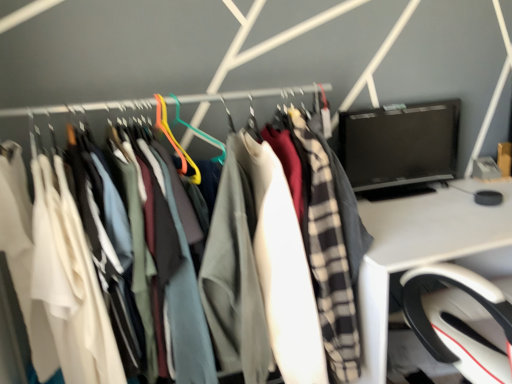
Question: Considering the relative sizes of matte fabric clothes at left and black glossy monitor at upper right in the image provided, is matte fabric clothes at left smaller than black glossy monitor at upper right?

Choices:
 (A) no
 (B) yes

Answer: (A)

Question: Does matte fabric clothes at left appear on the right side of black glossy monitor at upper right?

Choices:
 (A) no
 (B) yes

Answer: (A)

Question: Considering the relative positions of matte fabric clothes at left and black glossy monitor at upper right in the image provided, is matte fabric clothes at left in front of black glossy monitor at upper right?

Choices:
 (A) yes
 (B) no

Answer: (A)

Question: From a real-world perspective, is matte fabric clothes at left positioned over black glossy monitor at upper right based on gravity?

Choices:
 (A) no
 (B) yes

Answer: (A)

Question: Is matte fabric clothes at left to the left of black glossy monitor at upper right from the viewer's perspective?

Choices:
 (A) no
 (B) yes

Answer: (B)

Question: In terms of width, does matte fabric clothes at left look wider or thinner when compared to white glossy desk at right?

Choices:
 (A) wide
 (B) thin

Answer: (A)

Question: From the image's perspective, is matte fabric clothes at left above or below white glossy desk at right?

Choices:
 (A) below
 (B) above

Answer: (B)

Question: Would you say matte fabric clothes at left is inside or outside white glossy desk at right?

Choices:
 (A) outside
 (B) inside

Answer: (A)

Question: Is matte fabric clothes at left taller or shorter than white glossy desk at right?

Choices:
 (A) short
 (B) tall

Answer: (A)

Question: Considering the positions of black glossy monitor at upper right and matte fabric clothes at left in the image, is black glossy monitor at upper right wider or thinner than matte fabric clothes at left?

Choices:
 (A) wide
 (B) thin

Answer: (B)

Question: Considering the positions of point (346, 158) and point (326, 144), is point (346, 158) closer or farther from the camera than point (326, 144)?

Choices:
 (A) farther
 (B) closer

Answer: (A)

Question: In the image, is black glossy monitor at upper right positioned in front of or behind matte fabric clothes at left?

Choices:
 (A) behind
 (B) front

Answer: (A)

Question: Based on their sizes in the image, would you say black glossy monitor at upper right is bigger or smaller than matte fabric clothes at left?

Choices:
 (A) big
 (B) small

Answer: (B)

Question: From a real-world perspective, relative to black glossy monitor at upper right, is matte fabric clothes at left vertically above or below?

Choices:
 (A) above
 (B) below

Answer: (B)

Question: Considering the positions of point (292, 180) and point (419, 153), is point (292, 180) closer or farther from the camera than point (419, 153)?

Choices:
 (A) farther
 (B) closer

Answer: (B)